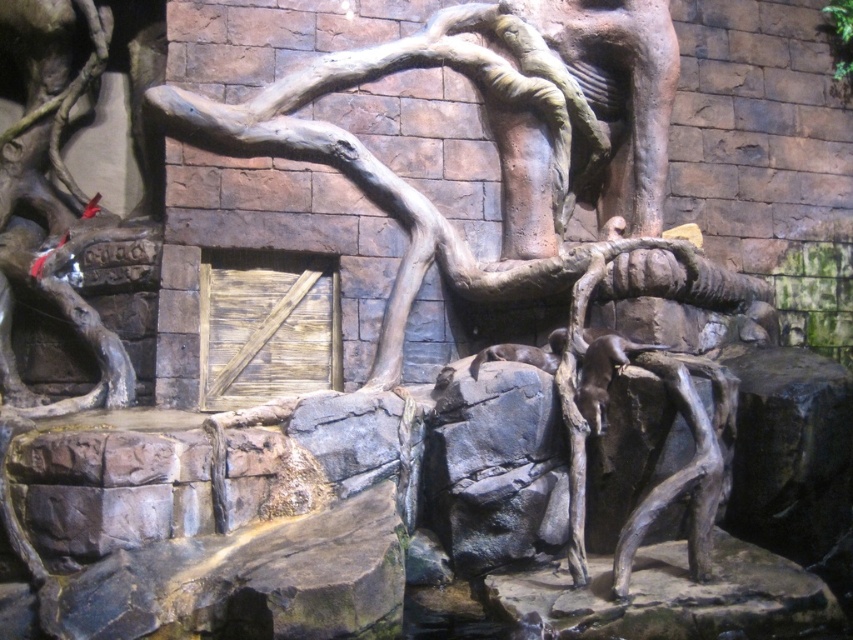
Based on the photo, you are an animal caretaker who needs to ensure the brown furry otter at center has enough space to move around the rustic wood tree trunk at center. Based on their sizes, can the otter easily navigate around the tree trunk?

The rustic wood tree trunk at center is wider than the brown furry otter at center, so the otter may need to maneuver carefully around it but should still be able to navigate given the trunk is a fixed structure and the otter is smaller in width.